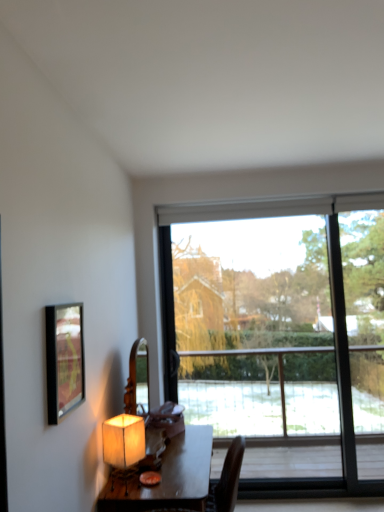
I want to click on vacant area located to the right-hand side of matte beige lampshade at lower left, so click(x=163, y=490).